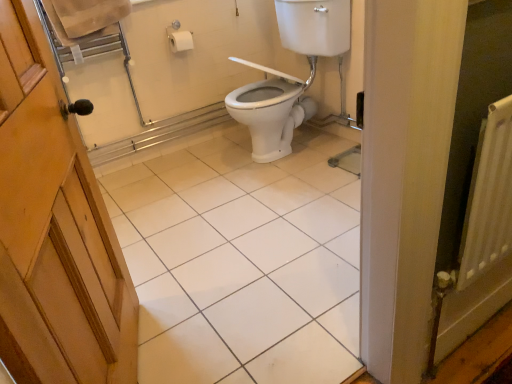
Question: From the image's perspective, is white glossy toilet at center under white glossy tile at center?

Choices:
 (A) no
 (B) yes

Answer: (A)

Question: Is white glossy toilet at center to the left of white glossy tile at center from the viewer's perspective?

Choices:
 (A) yes
 (B) no

Answer: (B)

Question: Can you confirm if white glossy toilet at center is smaller than white glossy tile at center?

Choices:
 (A) no
 (B) yes

Answer: (A)

Question: Is white glossy tile at center a part of white glossy toilet at center?

Choices:
 (A) yes
 (B) no

Answer: (B)

Question: Is the position of white glossy toilet at center more distant than that of white glossy tile at center?

Choices:
 (A) no
 (B) yes

Answer: (B)

Question: Is white glossy toilet at center shorter than white glossy tile at center?

Choices:
 (A) yes
 (B) no

Answer: (B)

Question: Is white glossy tile at center further to camera compared to white glossy toilet at center?

Choices:
 (A) yes
 (B) no

Answer: (B)

Question: Considering the relative sizes of white glossy tile at center and white glossy toilet at center in the image provided, is white glossy tile at center thinner than white glossy toilet at center?

Choices:
 (A) no
 (B) yes

Answer: (A)

Question: From the image's perspective, would you say white glossy tile at center is shown under white glossy toilet at center?

Choices:
 (A) yes
 (B) no

Answer: (A)

Question: Is white glossy tile at center positioned with its back to white glossy toilet at center?

Choices:
 (A) no
 (B) yes

Answer: (A)

Question: From a real-world perspective, is white glossy tile at center on top of white glossy toilet at center?

Choices:
 (A) yes
 (B) no

Answer: (B)

Question: Is white glossy tile at center bigger than white glossy toilet at center?

Choices:
 (A) yes
 (B) no

Answer: (B)

Question: Is white glossy tile at center inside or outside of white glossy toilet at center?

Choices:
 (A) inside
 (B) outside

Answer: (B)